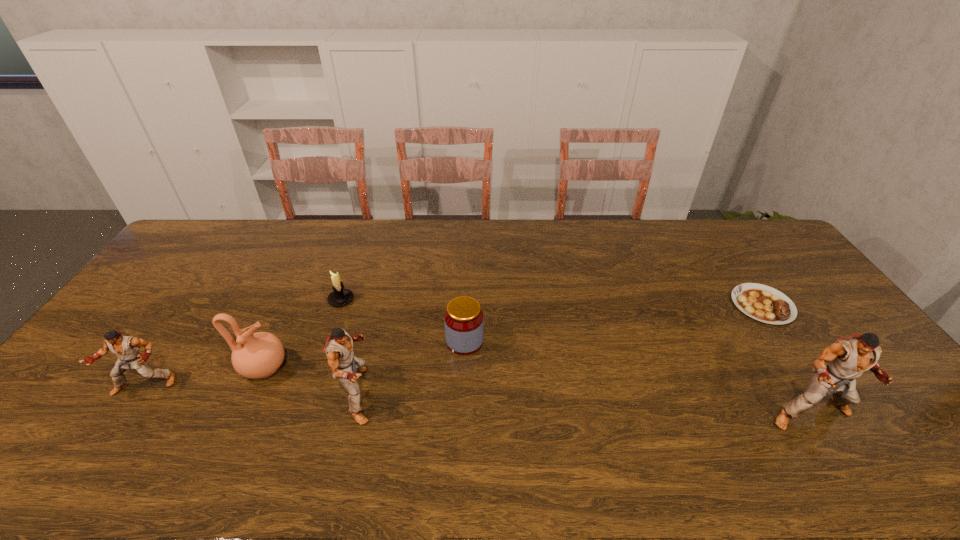
Identify the location of vacant space at the right edge of the desktop. This screenshot has height=540, width=960. (814, 302).

This screenshot has width=960, height=540. What are the coordinates of `vacant area at the near left corner of the desktop` in the screenshot? It's located at (45, 417).

Where is `vacant region between the candle holder and the pottery`? The image size is (960, 540). vacant region between the candle holder and the pottery is located at coordinates (302, 334).

At what (x,y) coordinates should I click in order to perform the action: click on free space that is in between the jar and the second tallest puncher. Please return your answer as a coordinate pair (x, y). This screenshot has height=540, width=960. Looking at the image, I should click on (412, 368).

The image size is (960, 540). Identify the location of vacant region between the sixth object from right to left and the fourth object from left to right. (312, 381).

Find the location of a particular element. unoccupied position between the candle holder and the steak is located at coordinates (552, 302).

What are the coordinates of `vacant region between the second shortest puncher and the rightmost puncher` in the screenshot? It's located at (585, 404).

You are a GUI agent. You are given a task and a screenshot of the screen. Output one action in this format:
    pyautogui.click(x=<x>, y=<y>)
    Task: Click on the free space between the rightmost puncher and the fifth object from right to left
    The height and width of the screenshot is (540, 960).
    Given the screenshot: What is the action you would take?
    pyautogui.click(x=576, y=357)

Identify the location of vacant point located between the shortest object and the rightmost puncher. The image size is (960, 540). [x=786, y=360].

The image size is (960, 540). I want to click on free space between the rightmost puncher and the sixth object from right to left, so click(x=538, y=391).